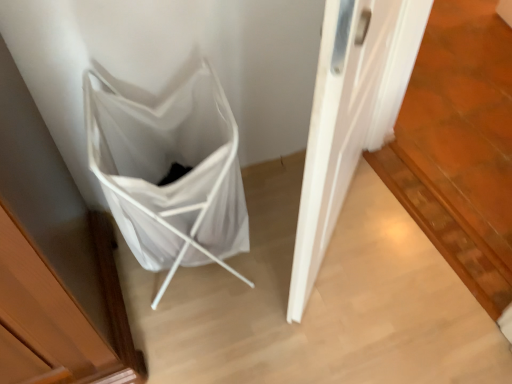
Where is `free space in front of white fabric folding chair at lower left`? Image resolution: width=512 pixels, height=384 pixels. free space in front of white fabric folding chair at lower left is located at coordinates (211, 344).